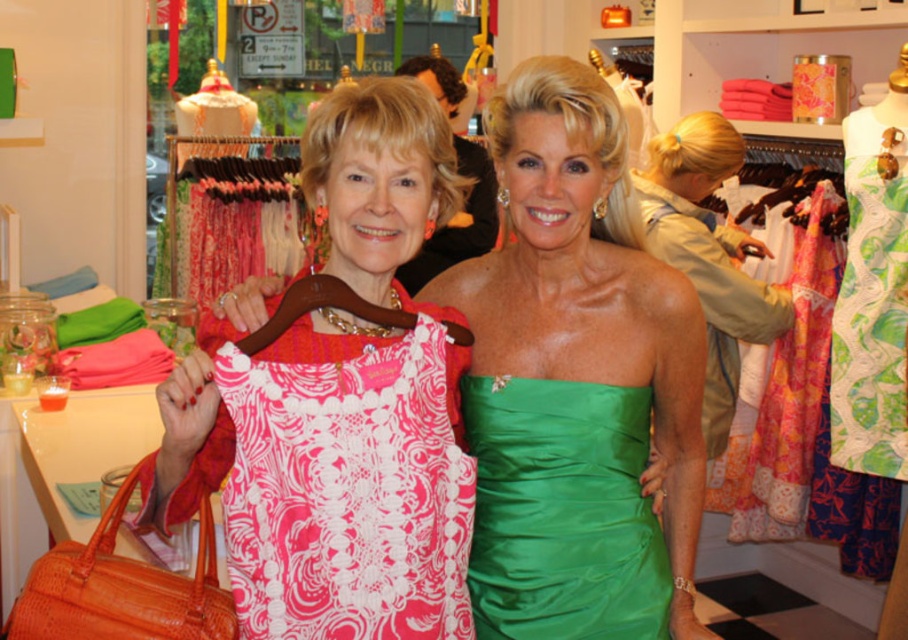
Where is `pink lace dress at center`? Image resolution: width=908 pixels, height=640 pixels. pink lace dress at center is located at coordinates (348, 484).

What do you see at coordinates (348, 484) in the screenshot? Image resolution: width=908 pixels, height=640 pixels. I see `pink lace dress at center` at bounding box center [348, 484].

Does point (337, 486) come closer to viewer compared to point (517, 618)?

Yes, it is.

The width and height of the screenshot is (908, 640). In order to click on pink lace dress at center in this screenshot , I will do click(348, 484).